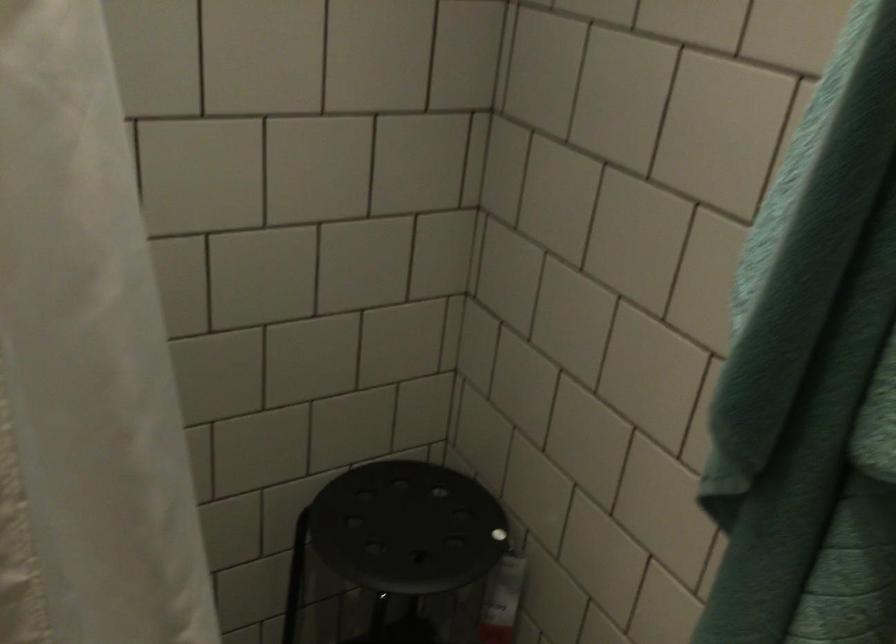
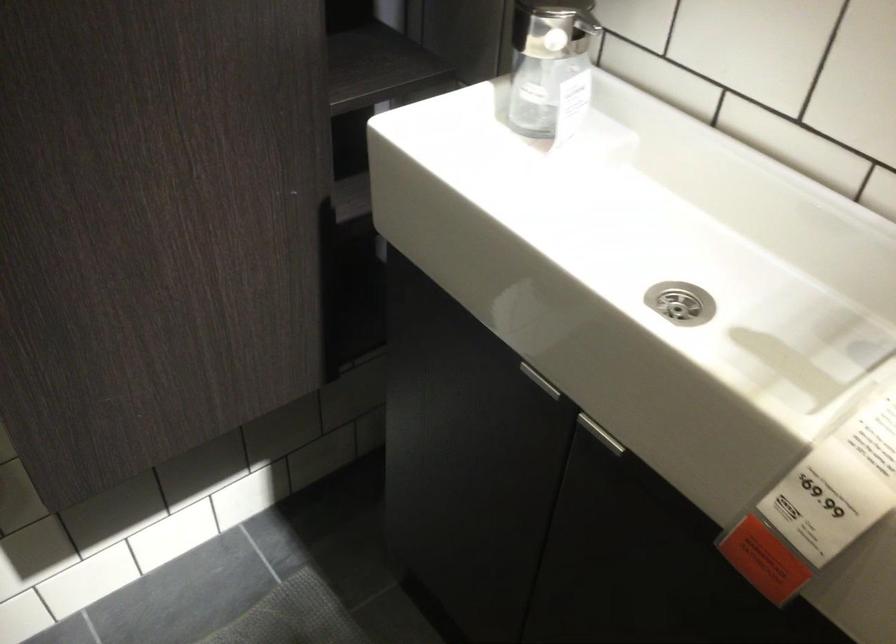
The images are taken continuously from a first-person perspective. In which direction is your viewpoint rotating?

The camera rotated toward left-down.